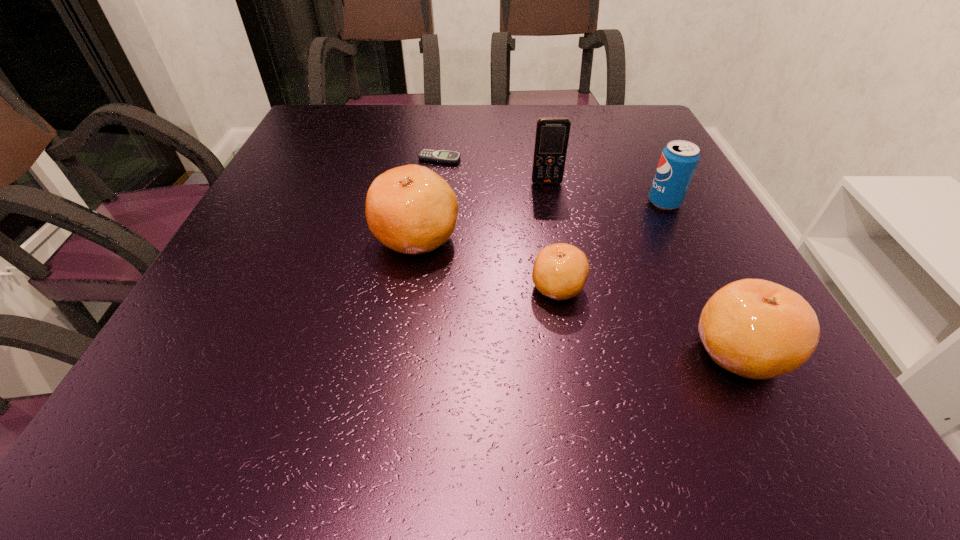
You are a GUI agent. You are given a task and a screenshot of the screen. Output one action in this format:
    pyautogui.click(x=<x>, y=<y>)
    Task: Click on the free space between the beeper and the rightmost clementine
    The height and width of the screenshot is (540, 960).
    Given the screenshot: What is the action you would take?
    pyautogui.click(x=589, y=255)

Find the location of a particular element. vacant area that lies between the fifth nearest object and the second shortest clementine is located at coordinates (643, 267).

Locate an element on the screen. The height and width of the screenshot is (540, 960). object that is the fourth closest one to the farthest object is located at coordinates (679, 159).

At what (x,y) coordinates should I click in order to perform the action: click on the closest object relative to the leftmost clementine. Please return your answer as a coordinate pair (x, y). The width and height of the screenshot is (960, 540). Looking at the image, I should click on (560, 271).

Locate an element on the screen. The image size is (960, 540). clementine object that ranks as the second closest to the nearest clementine is located at coordinates (410, 209).

Select which clementine appears as the closest to the soda can. Please provide its 2D coordinates. Your answer should be formatted as a tuple, i.e. [(x, y)], where the tuple contains the x and y coordinates of a point satisfying the conditions above.

[(560, 271)]